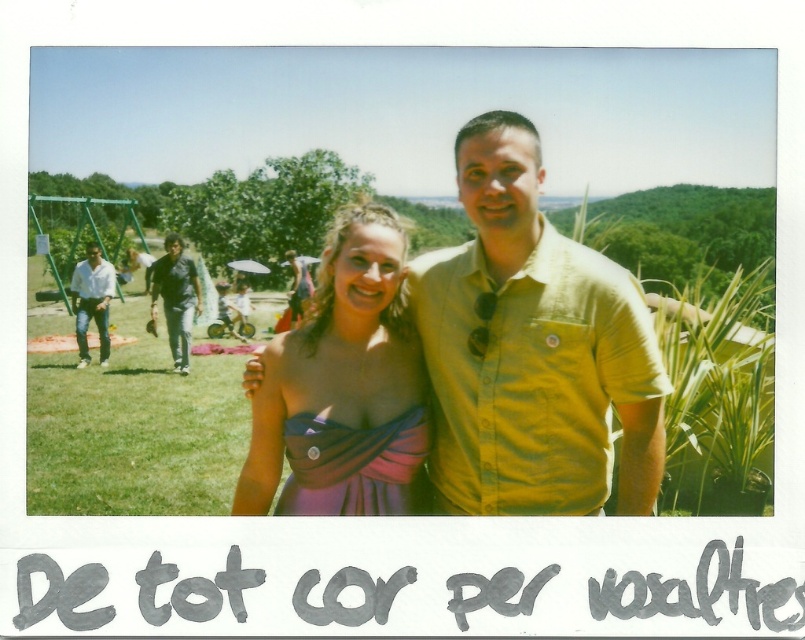
You are a photographer trying to capture a group photo of the dark blue jeans at left and the matte black dress at center. Since you want to ensure both are in the frame, which direction should you position yourself relative to the subjects?

Since the dark blue jeans at left is positioned on the left side of matte black dress at center, you should position yourself to the right of the subjects to ensure both are in the frame.

You are a photographer trying to capture a group photo of the matte white shirt at left and the matte black dress at center. The camera you are using has a maximum focus range of 15 feet. Can you take a photo of both subjects clearly without moving either of them?

The matte white shirt at left is 16.90 feet from the matte black dress at center. Since the camera can only focus up to 15 feet, the distance between them exceeds the maximum focus range. Therefore, you cannot take a photo of both subjects clearly without moving them closer together.

Consider the image. You are trying to decide which outfit to wear for a day at the park. You see the yellow cotton shirt at center and the purple satin dress at center in the image. Which one would you choose if you want to look taller?

The yellow cotton shirt at center is much taller as the purple satin dress at center, so choosing the yellow cotton shirt at center would make you appear taller.